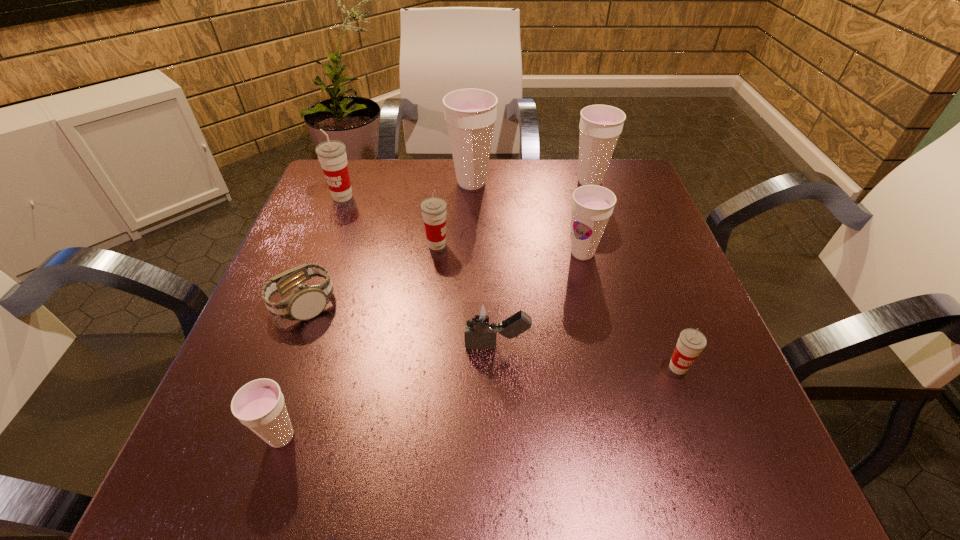
Identify the location of vacant area that lies between the nearest object and the second red cup from right to left. The image size is (960, 540). (359, 341).

Where is `unoccupied position between the nearest cup and the third farthest purple cup`? unoccupied position between the nearest cup and the third farthest purple cup is located at coordinates (432, 345).

The image size is (960, 540). Find the location of `vacant space that's between the igniter and the leftmost purple cup`. vacant space that's between the igniter and the leftmost purple cup is located at coordinates (389, 392).

Where is `empty location between the leftmost purple cup and the rightmost red cup`? empty location between the leftmost purple cup and the rightmost red cup is located at coordinates (480, 402).

I want to click on free space between the biggest purple cup and the second red cup from right to left, so click(454, 214).

Select which object appears as the third closest to the second biggest purple cup. Please provide its 2D coordinates. Your answer should be formatted as a tuple, i.e. [(x, y)], where the tuple contains the x and y coordinates of a point satisfying the conditions above.

[(433, 209)]

This screenshot has width=960, height=540. I want to click on the seventh closest object to the gray igniter, so click(600, 126).

Select which cup is the sixth closest to the third biggest purple cup. Please provide its 2D coordinates. Your answer should be formatted as a tuple, i.e. [(x, y)], where the tuple contains the x and y coordinates of a point satisfying the conditions above.

[(259, 405)]

Locate which cup is the third closest to the second nearest purple cup. Please provide its 2D coordinates. Your answer should be formatted as a tuple, i.e. [(x, y)], where the tuple contains the x and y coordinates of a point satisfying the conditions above.

[(691, 342)]

This screenshot has width=960, height=540. I want to click on purple cup that stands as the third closest to the tallest cup, so click(x=259, y=405).